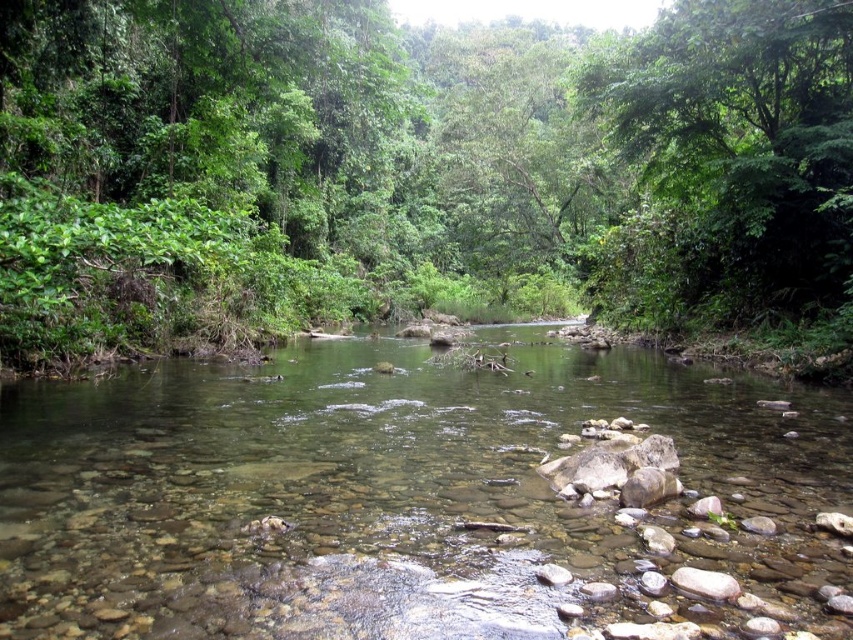
Question: Can you confirm if green leafy tree at center is positioned to the right of clear stone stream at center?

Choices:
 (A) yes
 (B) no

Answer: (A)

Question: Does green leafy tree at center appear under green leafy tree at upper center?

Choices:
 (A) yes
 (B) no

Answer: (B)

Question: Which point appears closest to the camera in this image?

Choices:
 (A) (762, 122)
 (B) (105, 470)

Answer: (B)

Question: Among these points, which one is nearest to the camera?

Choices:
 (A) (706, 630)
 (B) (529, 211)
 (C) (708, 54)

Answer: (A)

Question: Based on their relative distances, which object is farther from the clear stone stream at center?

Choices:
 (A) green leafy tree at upper center
 (B) green leafy tree at center

Answer: (B)

Question: Is clear stone stream at center positioned at the back of green leafy tree at upper center?

Choices:
 (A) no
 (B) yes

Answer: (A)